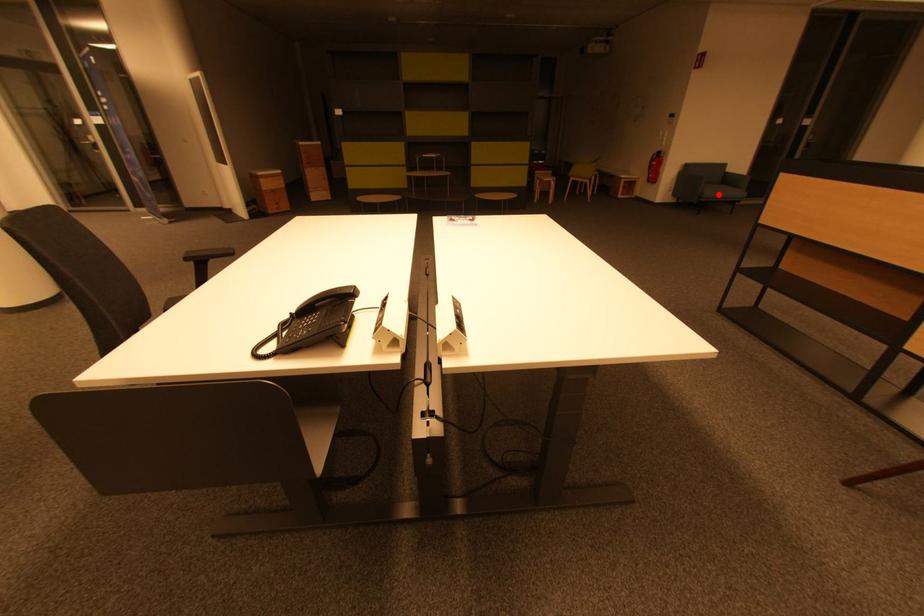
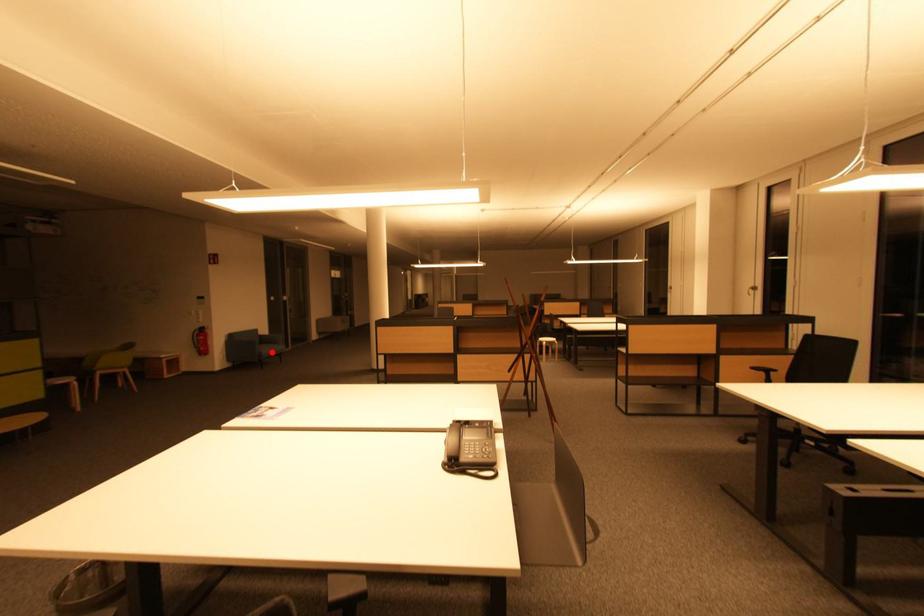
I am providing you with two images of the same scene from different viewpoints. A red point is marked on the first image and another point is marked on the second image. Is the marked point in image1 the same physical position as the marked point in image2?

Yes